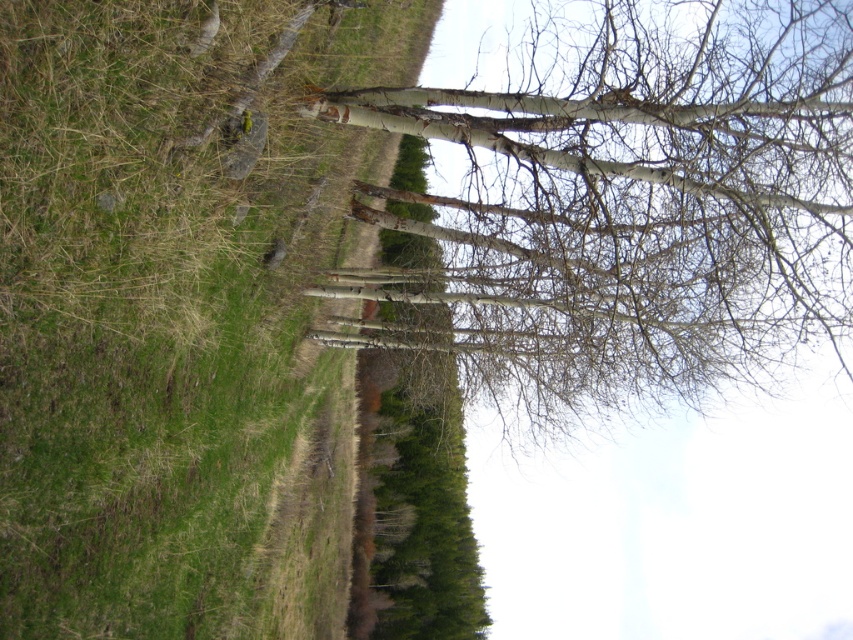
You are standing at the point marked as point (160, 298) in the image. Looking towards the dense line of evergreen trees in the background, which direction should you walk to reach the birch trees in the foreground?

You should walk towards the right because the birch trees are located to the right of the point (160, 298), which is on green grass at upper left.

You are planning to place a small garden ornament that requires a space of 1 square meter. Based on the scene, which area would be more suitable between the green grass at upper left and the white bark tree at center?

The white bark tree at center area is more suitable because the green grass at upper left has a smaller size compared to the white bark tree at center, meaning the area around the white bark tree at center can accommodate the 1 square meter requirement better.

You are standing in the natural outdoor scene with birch trees. You notice two points marked in the image. Which point, point (264, 109) or point (466, 280), is nearer to you?

Point (264, 109) is closer to the camera than point (466, 280), so it is nearer to you.